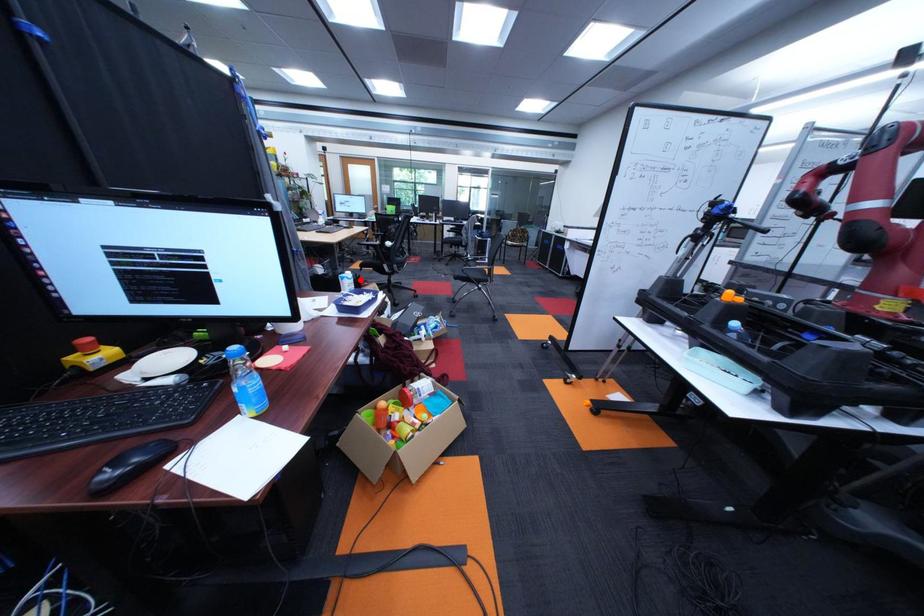
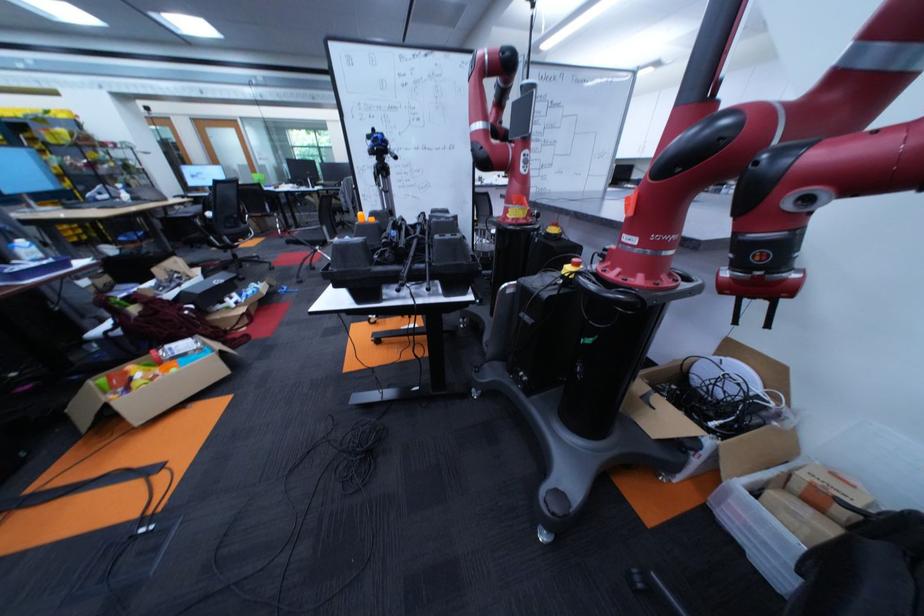
Question: I am providing you with two images of the same scene from different viewpoints. A red point is marked on the first image. Can you still see the location of the red point in image 2?

Choices:
 (A) Yes
 (B) No

Answer: (A)